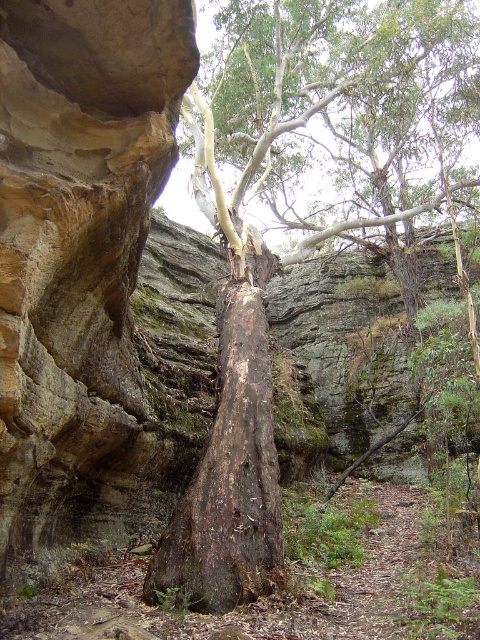
How much distance is there between dark brown bark tree at center and dark brown rough bark tree trunk at center?

The distance of dark brown bark tree at center from dark brown rough bark tree trunk at center is 3.55 feet.

Between point (265, 493) and point (243, 292), which one is positioned in front?

Point (265, 493) is more forward.

Which is in front, point (264, 314) or point (276, 513)?

Point (276, 513) is more forward.

Find the location of a particular element. The height and width of the screenshot is (640, 480). dark brown bark tree at center is located at coordinates (235, 408).